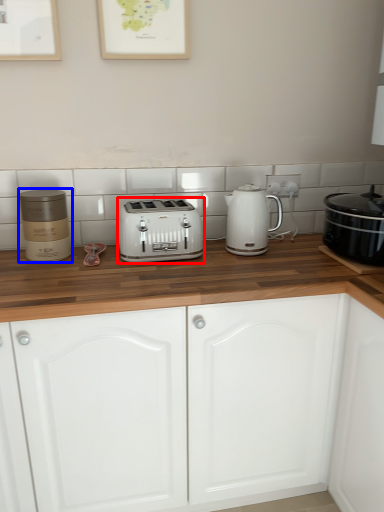
Question: Among these objects, which one is farthest to the camera, toaster (highlighted by a red box) or appliance (highlighted by a blue box)?

Choices:
 (A) toaster
 (B) appliance

Answer: (A)